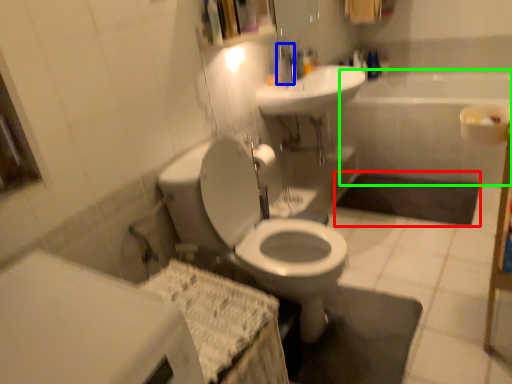
Question: Based on their relative distances, which object is farther from bath mat (highlighted by a red box)? Choose from faucet (highlighted by a blue box) and bath (highlighted by a green box).

Choices:
 (A) faucet
 (B) bath

Answer: (A)